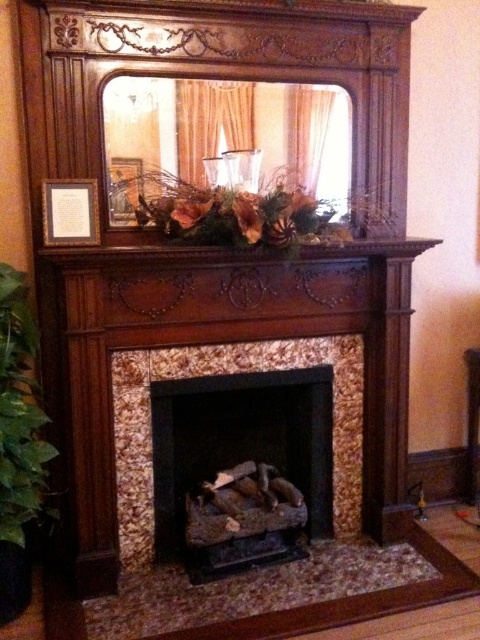
Which of these two, black stone fireplace at center or wooden mantel at upper center, stands shorter?

Standing shorter between the two is wooden mantel at upper center.

Between point (313, 456) and point (60, 253), which one is positioned behind?

The point (313, 456) is more distant.

Identify the location of black stone fireplace at center. (240, 454).

Who is taller, matte glass mirror at upper center or green leafy plant at left?

green leafy plant at left

Locate an element on the screen. This screenshot has height=640, width=480. matte glass mirror at upper center is located at coordinates (226, 140).

Is point (190, 120) farther from camera compared to point (22, 531)?

Yes, it is behind point (22, 531).

Find the location of a particular element. The height and width of the screenshot is (640, 480). matte glass mirror at upper center is located at coordinates (226, 140).

Can you confirm if matte brown picture frame at upper left is positioned to the left of matte gold picture frame at upper center?

Indeed, matte brown picture frame at upper left is positioned on the left side of matte gold picture frame at upper center.

Can you confirm if matte brown picture frame at upper left is thinner than matte gold picture frame at upper center?

No.

Does point (63, 224) lie behind point (140, 180)?

No, (63, 224) is in front of (140, 180).

At what (x,y) coordinates should I click in order to perform the action: click on matte brown picture frame at upper left. Please return your answer as a coordinate pair (x, y). Image resolution: width=480 pixels, height=640 pixels. Looking at the image, I should click on (70, 212).